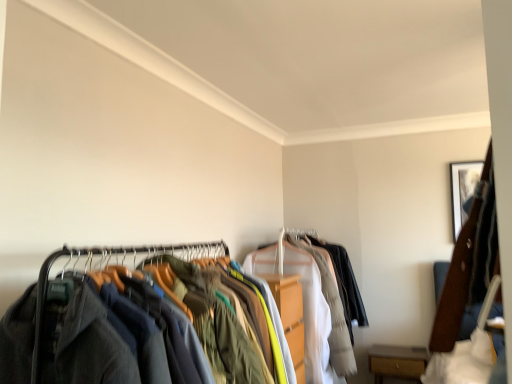
Question: From a real-world perspective, is light gray cotton shirt at center on top of brown wood drawer at lower right?

Choices:
 (A) no
 (B) yes

Answer: (B)

Question: Is light gray cotton shirt at center positioned behind brown wood drawer at lower right?

Choices:
 (A) no
 (B) yes

Answer: (A)

Question: Are light gray cotton shirt at center and brown wood drawer at lower right making contact?

Choices:
 (A) yes
 (B) no

Answer: (B)

Question: Would you say light gray cotton shirt at center is outside brown wood drawer at lower right?

Choices:
 (A) yes
 (B) no

Answer: (A)

Question: Is light gray cotton shirt at center at the left side of brown wood drawer at lower right?

Choices:
 (A) no
 (B) yes

Answer: (B)

Question: Would you say dark gray fabric clothes at left is to the left or to the right of wooden framed picture at upper right in the picture?

Choices:
 (A) right
 (B) left

Answer: (B)

Question: Is dark gray fabric clothes at left taller or shorter than wooden framed picture at upper right?

Choices:
 (A) tall
 (B) short

Answer: (A)

Question: From a real-world perspective, is dark gray fabric clothes at left above or below wooden framed picture at upper right?

Choices:
 (A) above
 (B) below

Answer: (B)

Question: Looking at the image, does dark gray fabric clothes at left seem bigger or smaller compared to wooden framed picture at upper right?

Choices:
 (A) big
 (B) small

Answer: (A)

Question: Is wooden framed picture at upper right in front of or behind light gray cotton shirt at center in the image?

Choices:
 (A) front
 (B) behind

Answer: (B)

Question: Visually, is wooden framed picture at upper right positioned to the left or to the right of light gray cotton shirt at center?

Choices:
 (A) left
 (B) right

Answer: (B)

Question: Considering the positions of wooden framed picture at upper right and light gray cotton shirt at center in the image, is wooden framed picture at upper right wider or thinner than light gray cotton shirt at center?

Choices:
 (A) thin
 (B) wide

Answer: (A)

Question: From a real-world perspective, is wooden framed picture at upper right above or below light gray cotton shirt at center?

Choices:
 (A) above
 (B) below

Answer: (A)

Question: In terms of size, does wooden framed picture at upper right appear bigger or smaller than dark gray fabric clothes at left?

Choices:
 (A) small
 (B) big

Answer: (A)

Question: Is wooden framed picture at upper right inside the boundaries of dark gray fabric clothes at left, or outside?

Choices:
 (A) outside
 (B) inside

Answer: (A)